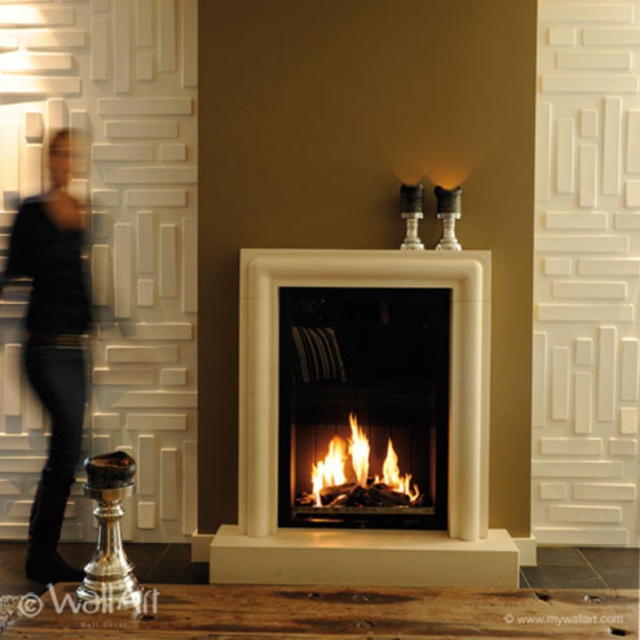
Who is higher up, white marble fireplace at center or orange flame wood at center?

white marble fireplace at center is above.

Between white marble fireplace at center and orange flame wood at center, which one appears on the right side from the viewer's perspective?

From the viewer's perspective, orange flame wood at center appears more on the right side.

Is point (516, 580) positioned in front of point (369, 464)?

Yes, it is in front of point (369, 464).

I want to click on white marble fireplace at center, so [x=449, y=435].

Can you confirm if black matte shirt at left is taller than orange flame wood at center?

Correct, black matte shirt at left is much taller as orange flame wood at center.

Is black matte shirt at left above orange flame wood at center?

Yes, black matte shirt at left is above orange flame wood at center.

I want to click on black matte shirt at left, so click(52, 344).

Which is in front, point (246, 540) or point (49, 316)?

Point (49, 316) is in front.

Is point (250, 376) less distant than point (54, 269)?

No, it is behind (54, 269).

Locate an element on the screen. white marble fireplace at center is located at coordinates (449, 435).